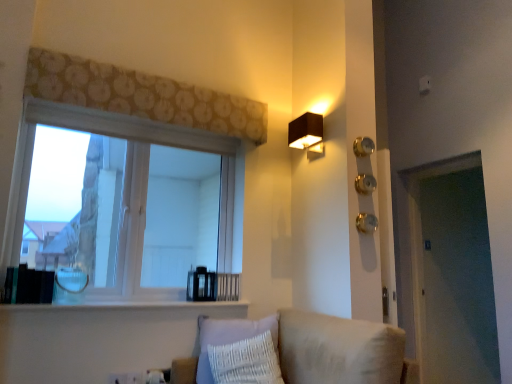
Question: Is black matte rectangular lamp at upper right far away from white glossy window sill at lower center?

Choices:
 (A) no
 (B) yes

Answer: (B)

Question: Does black matte rectangular lamp at upper right lie behind white glossy window sill at lower center?

Choices:
 (A) yes
 (B) no

Answer: (A)

Question: Is black matte rectangular lamp at upper right positioned in front of white glossy window sill at lower center?

Choices:
 (A) no
 (B) yes

Answer: (A)

Question: Does black matte rectangular lamp at upper right have a greater width compared to white glossy window sill at lower center?

Choices:
 (A) yes
 (B) no

Answer: (B)

Question: From the image's perspective, is black matte rectangular lamp at upper right over white glossy window sill at lower center?

Choices:
 (A) no
 (B) yes

Answer: (B)

Question: From a real-world perspective, is white wood window at upper left physically located above or below patterned fabric curtain at upper center?

Choices:
 (A) above
 (B) below

Answer: (B)

Question: From their relative heights in the image, would you say white wood window at upper left is taller or shorter than patterned fabric curtain at upper center?

Choices:
 (A) tall
 (B) short

Answer: (A)

Question: Considering the relative positions of white wood window at upper left and patterned fabric curtain at upper center in the image provided, is white wood window at upper left to the left or to the right of patterned fabric curtain at upper center?

Choices:
 (A) left
 (B) right

Answer: (A)

Question: From the image's perspective, is white wood window at upper left positioned above or below patterned fabric curtain at upper center?

Choices:
 (A) below
 (B) above

Answer: (A)

Question: From a real-world perspective, is black matte rectangular lamp at upper right physically located above or below beige fabric couch at lower center?

Choices:
 (A) above
 (B) below

Answer: (A)

Question: From the image's perspective, relative to beige fabric couch at lower center, is black matte rectangular lamp at upper right above or below?

Choices:
 (A) above
 (B) below

Answer: (A)

Question: Looking at the image, does black matte rectangular lamp at upper right seem bigger or smaller compared to beige fabric couch at lower center?

Choices:
 (A) small
 (B) big

Answer: (A)

Question: Is black matte rectangular lamp at upper right situated inside beige fabric couch at lower center or outside?

Choices:
 (A) inside
 (B) outside

Answer: (B)

Question: Considering the positions of white plastic electric outlet at lower left, the second electric outlet when ordered from right to left, and gold metallic knob at right, the second knob in the top-to-bottom sequence, in the image, is white plastic electric outlet at lower left, the second electric outlet when ordered from right to left, wider or thinner than gold metallic knob at right, the second knob in the top-to-bottom sequence,?

Choices:
 (A) wide
 (B) thin

Answer: (B)

Question: Is white plastic electric outlet at lower left, the second electric outlet when ordered from right to left, spatially inside gold metallic knob at right, which is the second knob in bottom-to-top order, or outside of it?

Choices:
 (A) inside
 (B) outside

Answer: (B)